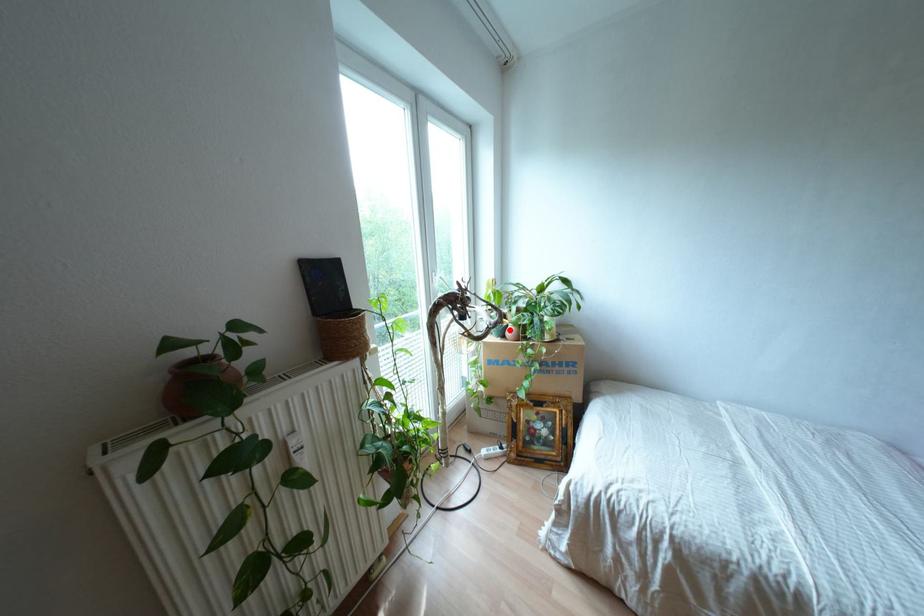
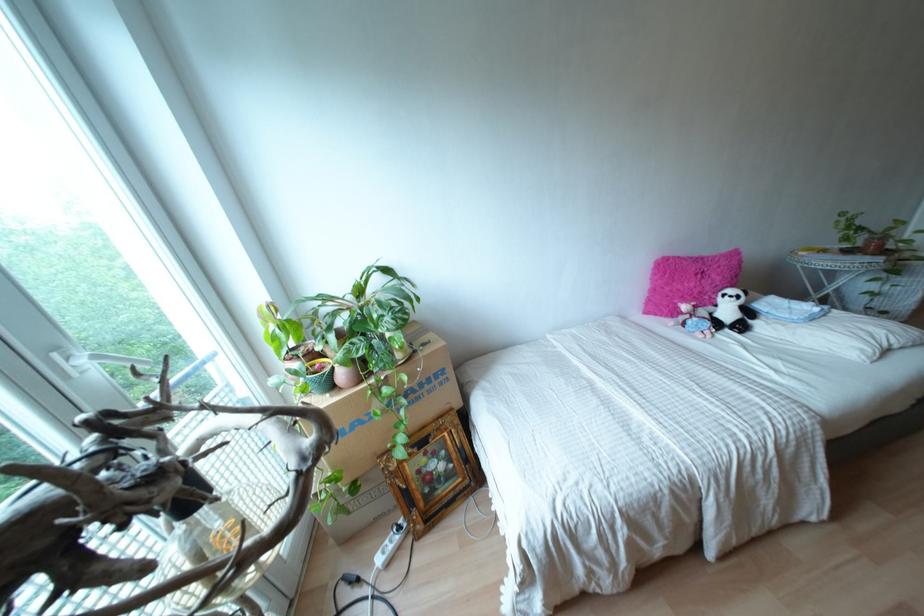
Where in the second image is the point corresponding to the highlighted location from the first image?

(342, 374)